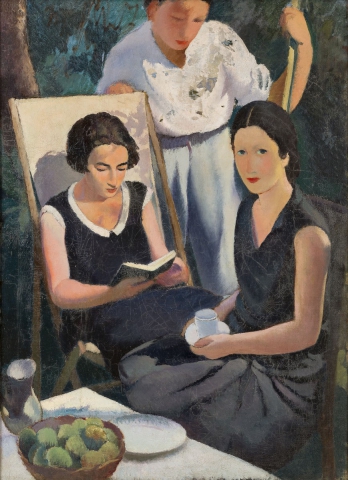
Identify the location of white china. The image size is (348, 480). (148, 431), (188, 336), (201, 326).